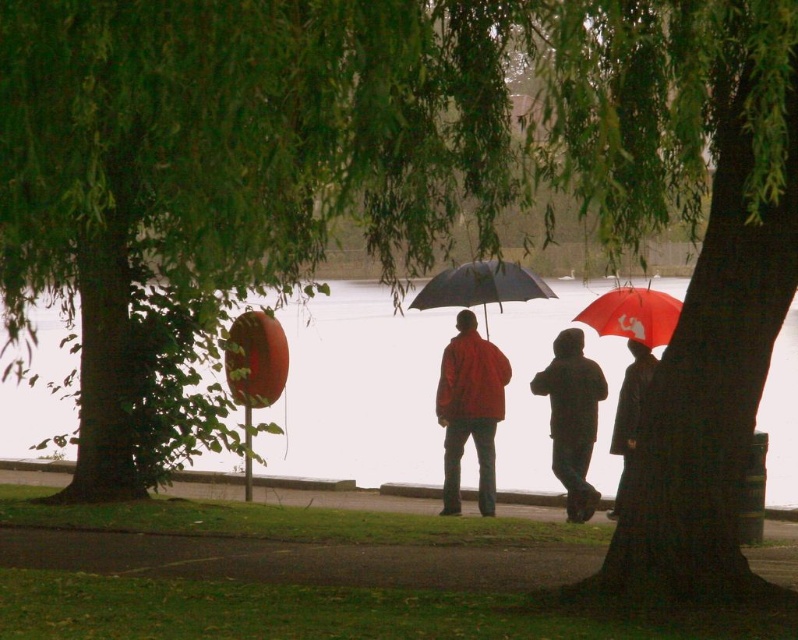
You are a hiker who wants to stay dry from the rain. You see the green leafy tree at center and the dark brown hooded coat at center. Which one can provide better shelter from the rain?

The green leafy tree at center is positioned over the dark brown hooded coat at center, so the tree might offer some shelter from the rain. However, since it is raining, the tree may not be as effective as the hooded coat in keeping you dry. The dark brown hooded coat at center would be a better option for staying dry.

You are a photographer trying to capture a clear shot of the matte red jacket at center and the matte black umbrella at center. Since the trees are blocking some light, you want to ensure both subjects are fully visible. Given their sizes, which subject might require you to adjust your camera settings for better visibility?

The matte red jacket at center is much taller than the matte black umbrella at center, so adjusting the camera settings to accommodate the larger size of the matte red jacket at center would ensure both are fully visible.

Looking at this image, you are a photographer trying to capture the scene from the given point. Based on the coordinates provided, which object is located exactly at point (x=469, y=410)?

The point (x=469, y=410) indicates the location of the matte red jacket at center.